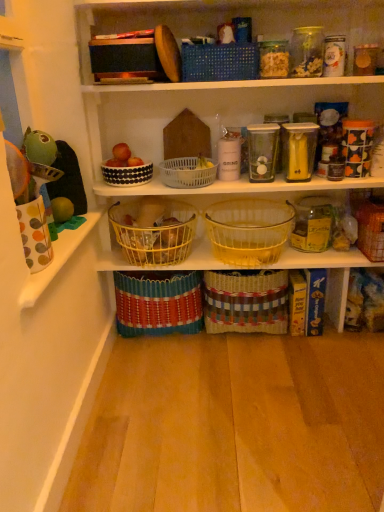
The width and height of the screenshot is (384, 512). Identify the location of free space in front of woven brown basket at center, the 2th basket from the bottom. point(264,362).